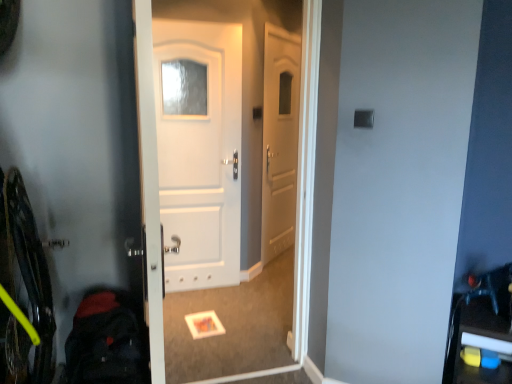
Question: Is point (258, 345) closer or farther from the camera than point (115, 355)?

Choices:
 (A) closer
 (B) farther

Answer: (B)

Question: Based on their sizes in the image, would you say white matte door at center is bigger or smaller than dark blue backpack at lower left?

Choices:
 (A) small
 (B) big

Answer: (B)

Question: Is white matte door at center spatially inside dark blue backpack at lower left, or outside of it?

Choices:
 (A) outside
 (B) inside

Answer: (A)

Question: From the image's perspective, relative to white matte door at center, is dark blue backpack at lower left above or below?

Choices:
 (A) below
 (B) above

Answer: (A)

Question: Based on their sizes in the image, would you say dark blue backpack at lower left is bigger or smaller than white matte door at center?

Choices:
 (A) big
 (B) small

Answer: (B)

Question: From their relative heights in the image, would you say dark blue backpack at lower left is taller or shorter than white matte door at center?

Choices:
 (A) short
 (B) tall

Answer: (A)

Question: Considering the positions of point (101, 316) and point (167, 39), is point (101, 316) closer or farther from the camera than point (167, 39)?

Choices:
 (A) closer
 (B) farther

Answer: (A)